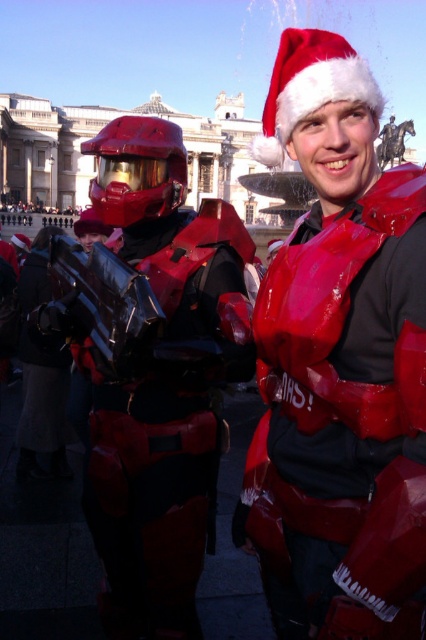
You are a photographer setting up for a photo shoot with two models dressed as described. You need to ensure that the shiny plastic santa hat at upper center is visible in the shot without being blocked by the glossy red armor at center. Based on their positions, will the hat be visible?

The shiny plastic santa hat at upper center is above the glossy red armor at center, so it will be visible and not blocked by the armor.

You are organizing a costume party and need to decide which costume requires more storage space. Based on the image, which object from the shiny plastic santa hat at upper center and the glossy red armor at center indicates the size of the costume?

The shiny plastic santa hat at upper center is larger in size than the glossy red armor at center, so the Santa hat suggests the costume requires more storage space.

You are a photographer setting up for a photo shoot with two characters. You have a wide angle lens that can capture objects up to 1 meter in width. The scene includes a shiny plastic santa hat at upper center and a glossy red armor at center. Which character will fit better in your frame considering the lens limitation?

The shiny plastic santa hat at upper center has a lesser width compared to the glossy red armor at center, so it will fit better in the photographer frame with the wide angle lens.